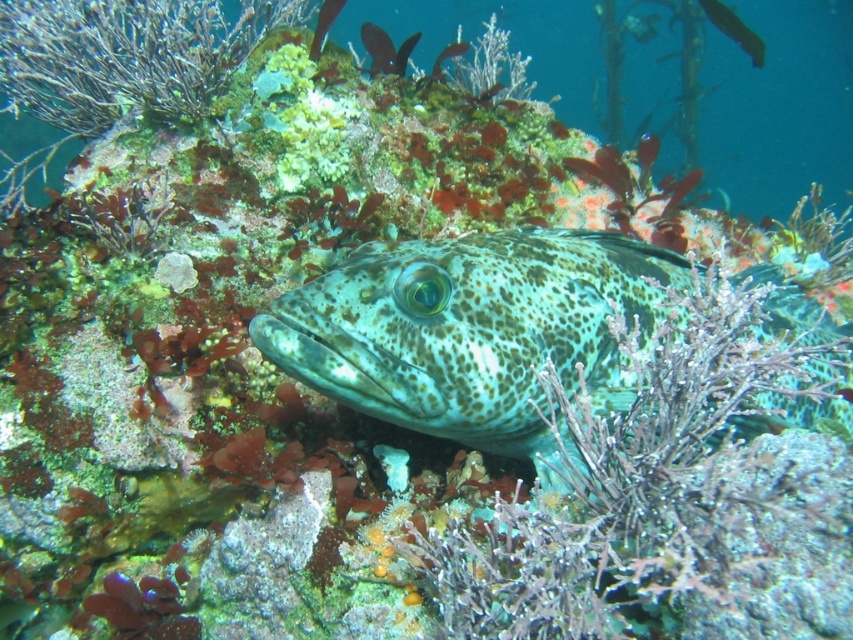
Question: Does spotted green fish at upper center appear on the right side of speckled green fish at upper right?

Choices:
 (A) yes
 (B) no

Answer: (B)

Question: Considering the real-world distances, which object is farthest from the speckled green fish at upper center?

Choices:
 (A) spotted green fish at upper center
 (B) speckled green fish at upper right
 (C) speckled green fish at center

Answer: (B)

Question: From the image, what is the correct spatial relationship of speckled greenish-blue fish at center in relation to speckled green fish at upper right?

Choices:
 (A) left
 (B) right

Answer: (A)

Question: Which object appears closest to the camera in this image?

Choices:
 (A) speckled green fish at upper right
 (B) speckled green fish at center

Answer: (B)

Question: Based on their relative distances, which object is farther from the speckled greenish-blue fish at center?

Choices:
 (A) speckled green fish at upper center
 (B) speckled green fish at center
 (C) speckled green fish at upper right

Answer: (C)

Question: Can you confirm if speckled green fish at upper right is wider than speckled green fish at upper center?

Choices:
 (A) yes
 (B) no

Answer: (A)